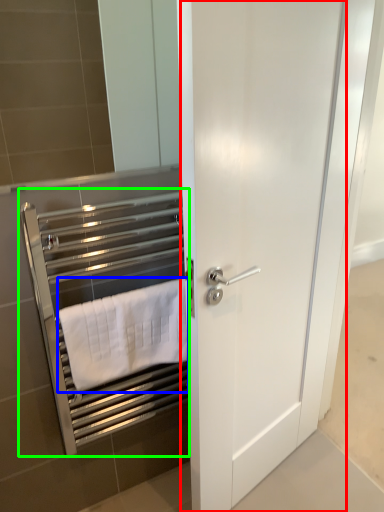
Question: Which object is positioned farthest from door (highlighted by a red box)? Select from towel (highlighted by a blue box) and closet (highlighted by a green box).

Choices:
 (A) towel
 (B) closet

Answer: (B)